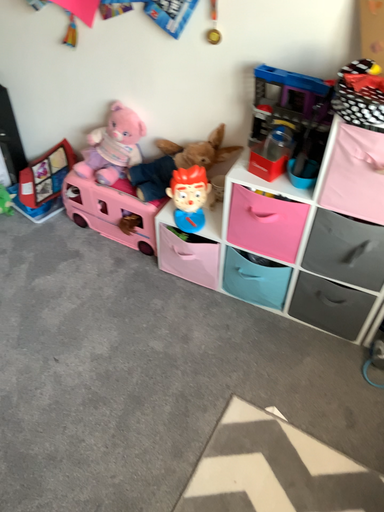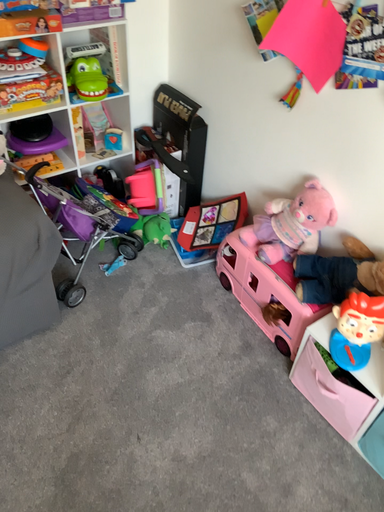
Question: Which way did the camera rotate in the video?

Choices:
 (A) rotated downward
 (B) rotated upward

Answer: (B)